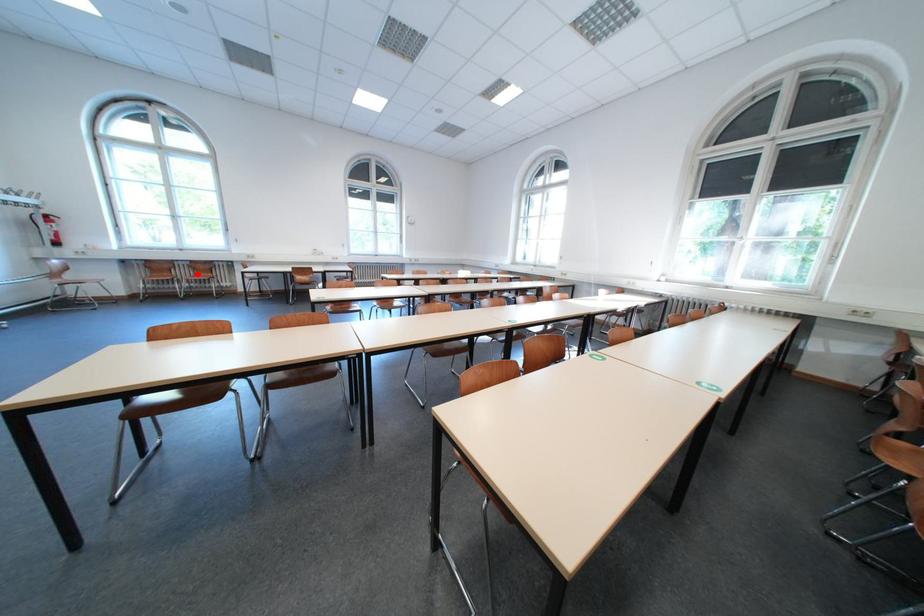
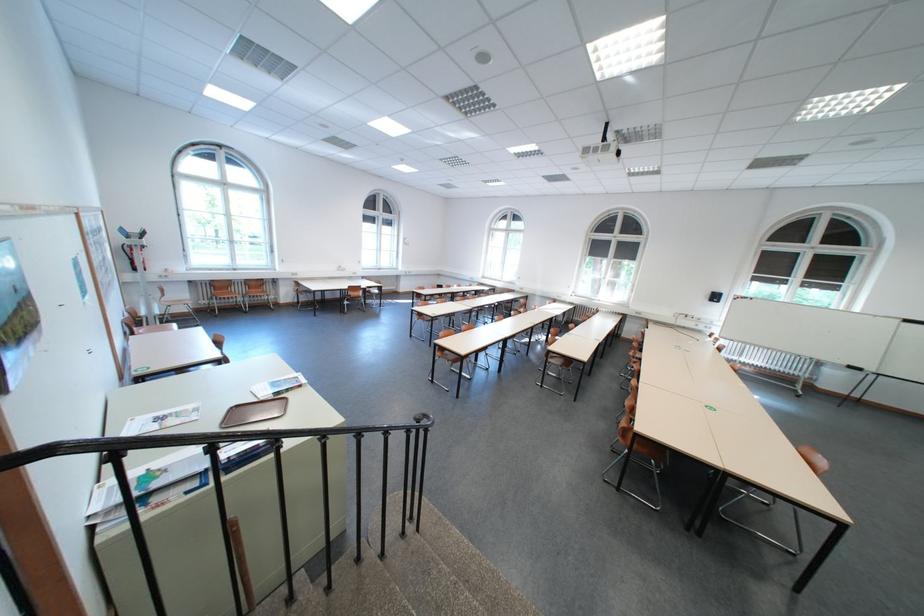
Question: I am providing you with two images of the same scene from different viewpoints. Image1 has a red point marked. In image2, the corresponding 3D location appears at what relative position? Reply with the corresponding letter.

Choices:
 (A) Closer
 (B) Farther

Answer: (A)